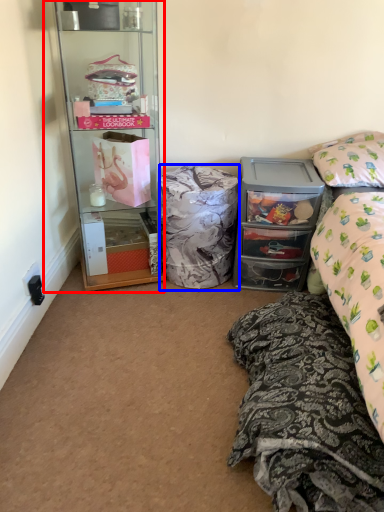
Question: Which of the following is the closest to the observer, desk (highlighted by a red box) or material (highlighted by a blue box)?

Choices:
 (A) desk
 (B) material

Answer: (A)